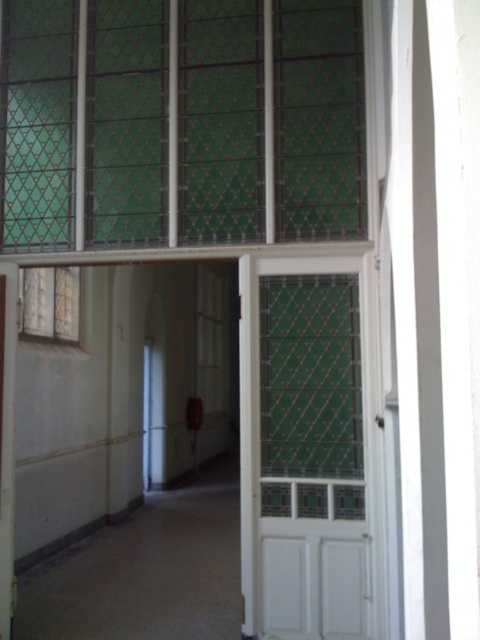
Question: Based on their relative distances, which object is farther from the white wood door at center?

Choices:
 (A) white frosted glass window at left
 (B) white wooden door at center
 (C) green textured glass at upper center

Answer: (A)

Question: Which point is farther to the camera?

Choices:
 (A) (314, 416)
 (B) (152, 138)

Answer: (B)

Question: Is green textured glass at upper center behind white wooden door at center?

Choices:
 (A) yes
 (B) no

Answer: (A)

Question: Which of the following is the farthest from the observer?

Choices:
 (A) (51, 19)
 (B) (73, 324)
 (C) (10, 400)

Answer: (B)

Question: Does white wood door at center come behind white wooden door at center?

Choices:
 (A) yes
 (B) no

Answer: (B)

Question: Does white wood door at center appear over white frosted glass window at left?

Choices:
 (A) yes
 (B) no

Answer: (B)